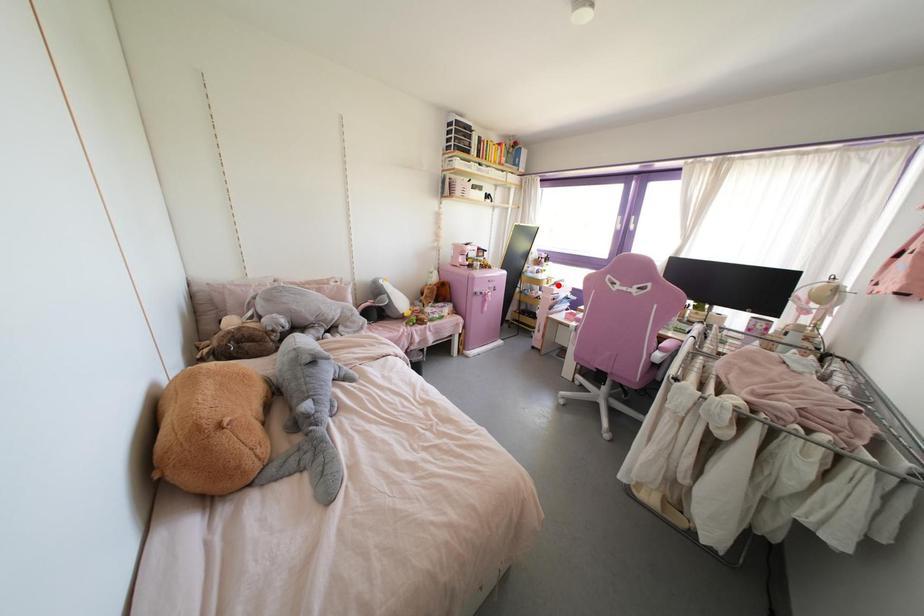
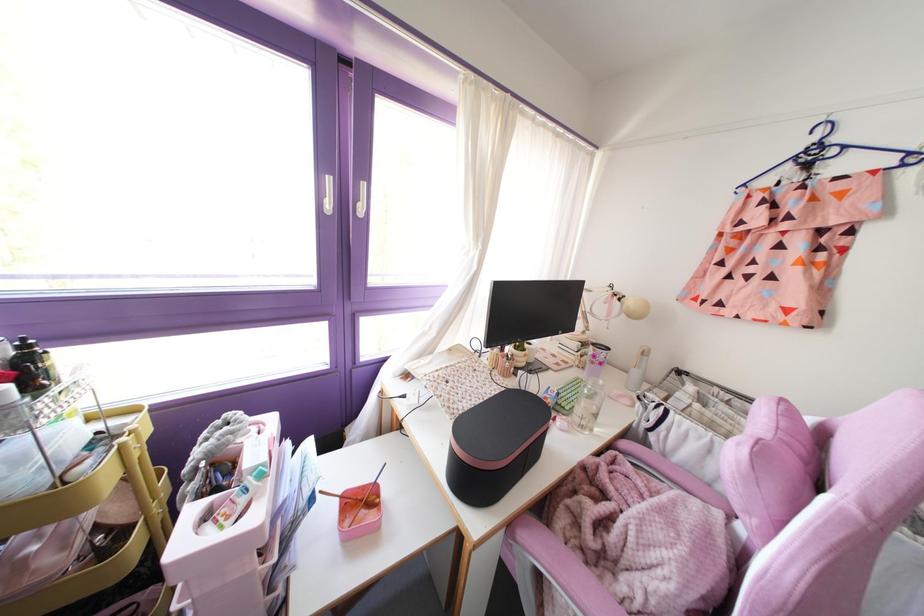
Question: I am providing you with two images of the same scene from different viewpoints. Given a red point in image1, look at the same physical point in image2. Is it:

Choices:
 (A) Closer to the viewpoint
 (B) Farther from the viewpoint

Answer: (B)